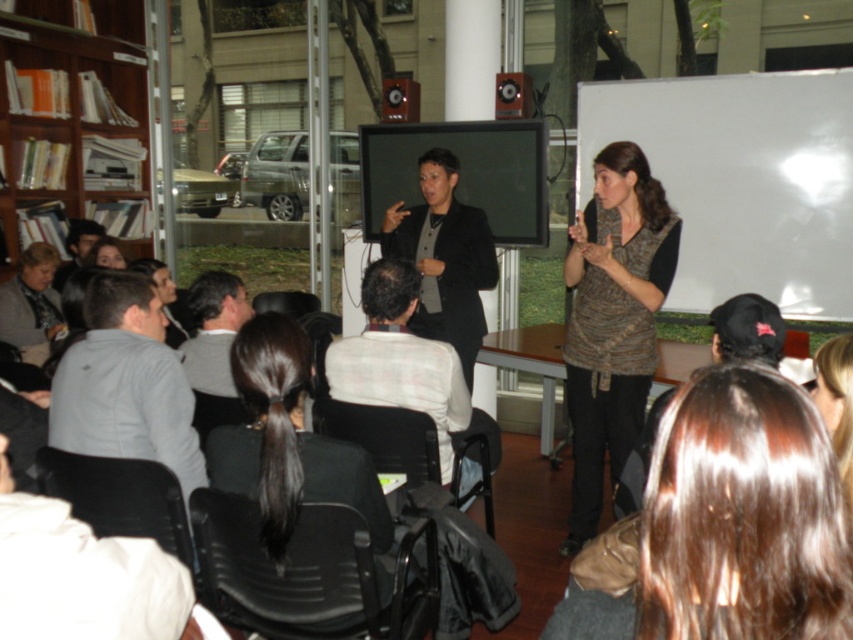
You are an attendee at the presentation and you want to know which presenter is closer to the front of the room. The brown hair at upper center and the white checkered shirt at center are both presenters. Which one is positioned closer to the front?

The brown hair at upper center is shorter than the white checkered shirt at center, so the brown hair at upper center is positioned closer to the front of the room.

You are an attendee sitting in the back row of the presentation. You notice two items in your line of sight. One is the brown hair at upper center and the other is the light gray sweater at lower left. Which one appears closer to you?

The brown hair at upper center appears closer to you because it is positioned below the light gray sweater at lower left, meaning it is lower in the visual field and thus nearer in the seating arrangement.